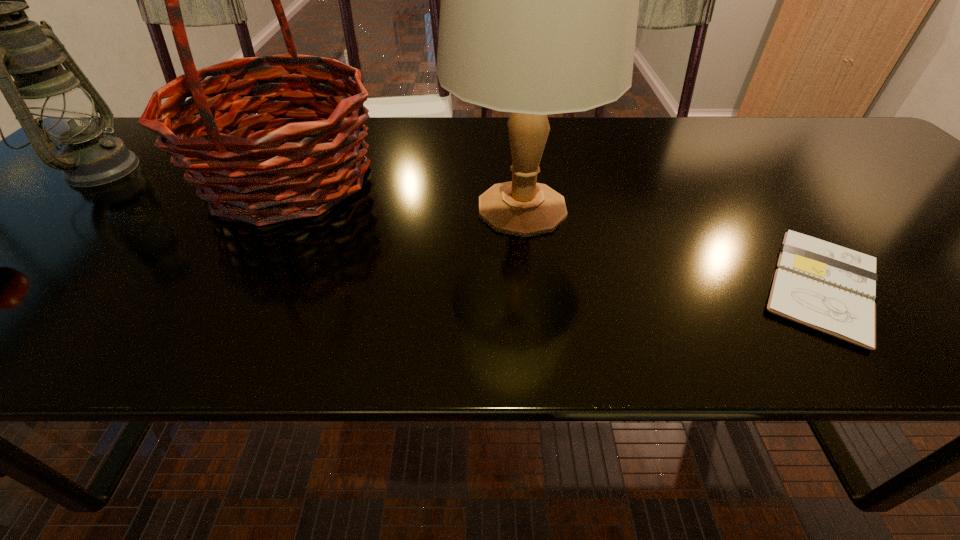
You are a GUI agent. You are given a task and a screenshot of the screen. Output one action in this format:
    pyautogui.click(x=<x>, y=<y>)
    Task: Click on the unoccupied position between the shortest object and the third tallest object
    
    Given the screenshot: What is the action you would take?
    pyautogui.click(x=461, y=228)

The image size is (960, 540). Identify the location of vacant area that lies between the rightmost object and the basket. (556, 232).

Image resolution: width=960 pixels, height=540 pixels. Identify the location of unoccupied area between the rightmost object and the second object from left to right. pos(556,232).

Locate an element on the screen. Image resolution: width=960 pixels, height=540 pixels. free space between the oil lamp and the notepad is located at coordinates (461, 228).

I want to click on free point between the rightmost object and the basket, so click(x=556, y=232).

The image size is (960, 540). Identify the location of vacant area that lies between the shortest object and the table lamp. (672, 247).

Find the location of a particular element. object identified as the closest to the table lamp is located at coordinates (236, 172).

The image size is (960, 540). What are the coordinates of `object that is the closest to the oil lamp` in the screenshot? It's located at tap(236, 172).